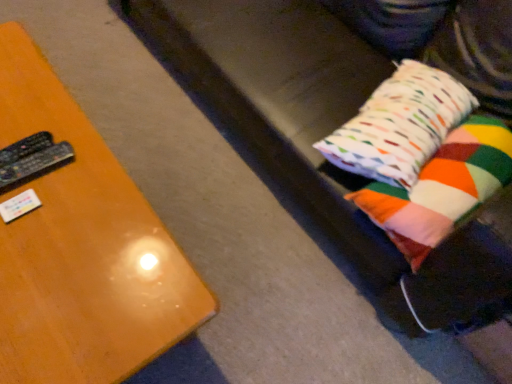
Where is `free point behind black plastic remote at left, placed as the 1th remote when sorted from top to bottom`? This screenshot has width=512, height=384. free point behind black plastic remote at left, placed as the 1th remote when sorted from top to bottom is located at coordinates (36, 110).